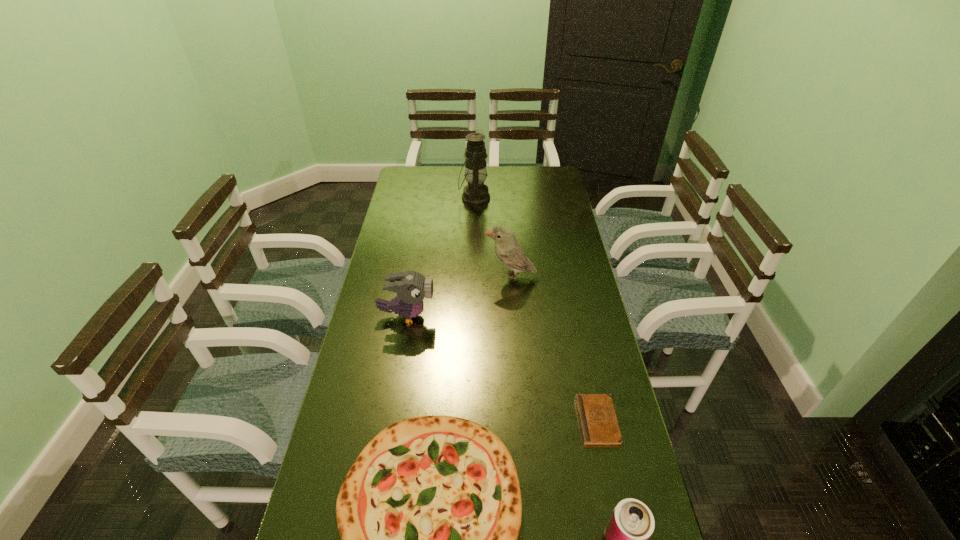
You are a GUI agent. You are given a task and a screenshot of the screen. Output one action in this format:
    pyautogui.click(x=<x>, y=<y>)
    Task: Click on the oil lamp
    This screenshot has width=960, height=540.
    Given the screenshot: What is the action you would take?
    pyautogui.click(x=476, y=193)

The image size is (960, 540). Find the location of `the tallest object`. the tallest object is located at coordinates (476, 193).

Identify the location of the right bird. (509, 251).

The width and height of the screenshot is (960, 540). In order to click on the fifth nearest object in this screenshot , I will do `click(509, 251)`.

Find the location of a particular element. This screenshot has height=540, width=960. the nearer bird is located at coordinates (411, 287).

What are the coordinates of `the third tallest object` in the screenshot? It's located at (411, 287).

The image size is (960, 540). I want to click on the shortest object, so click(x=598, y=422).

At what (x,y) coordinates should I click in order to perform the action: click on free location located 0.090m on the right of the oil lamp. Please return your answer as a coordinate pair (x, y). The image size is (960, 540). Looking at the image, I should click on (511, 198).

At what (x,y) coordinates should I click in order to perform the action: click on free space located at the face of the right bird. Please return your answer as a coordinate pair (x, y). The height and width of the screenshot is (540, 960). Looking at the image, I should click on click(382, 277).

The height and width of the screenshot is (540, 960). I want to click on free spot located at the face of the right bird, so click(x=465, y=277).